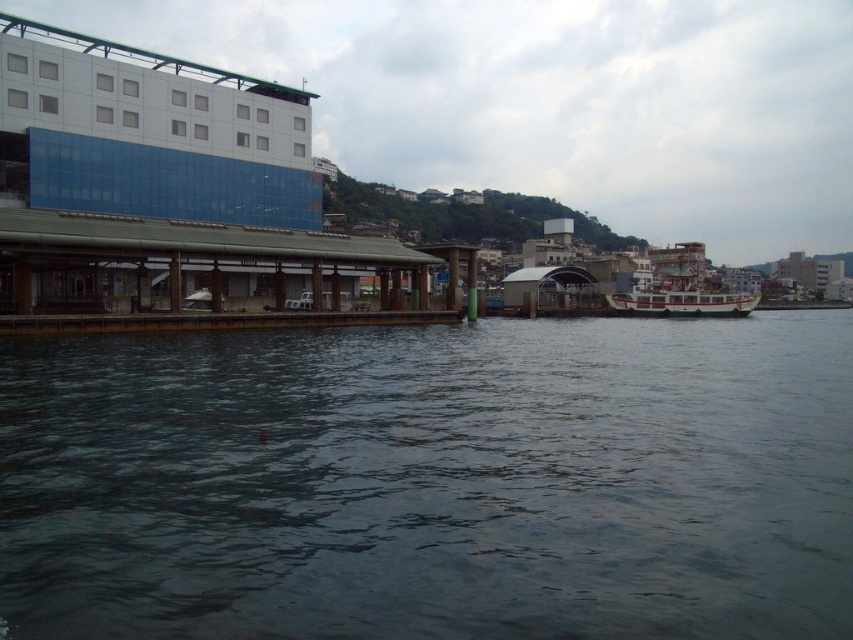
Image resolution: width=853 pixels, height=640 pixels. What do you see at coordinates (432, 481) in the screenshot?
I see `dark water at lower center` at bounding box center [432, 481].

Is dark water at lower center positioned before brown wooden dock at lower left?

Yes, it is.

The width and height of the screenshot is (853, 640). I want to click on dark water at lower center, so click(x=432, y=481).

Is brown wooden dock at lower left positioned behind white matte boat at center?

No, it is not.

Who is higher up, brown wooden dock at lower left or white matte boat at center?

white matte boat at center is higher up.

Based on the photo, who is more forward, (x=268, y=296) or (x=677, y=285)?

Point (x=268, y=296)

Identify the location of brown wooden dock at lower left. This screenshot has height=640, width=853. (198, 275).

How much distance is there between dark water at lower center and white matte boat at center?

dark water at lower center and white matte boat at center are 68.99 meters apart.

At what (x,y) coordinates should I click in order to perform the action: click on dark water at lower center. Please return your answer as a coordinate pair (x, y). This screenshot has width=853, height=640. Looking at the image, I should click on (432, 481).

Is point (47, 472) positioned behind point (662, 257)?

No, it is in front of (662, 257).

Find the location of a particular element. dark water at lower center is located at coordinates (432, 481).